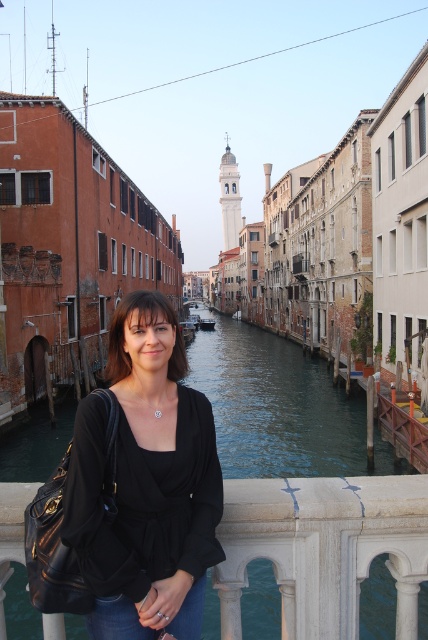
What is the 2D coordinate of the black matte shirt at center in the image?

The 2D coordinate of the black matte shirt at center is at point (145, 483).